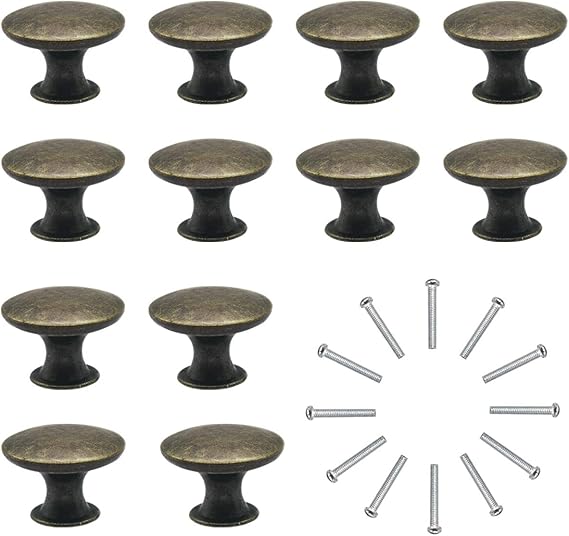
I want to click on two knobs in fourth row down, so click(218, 466), click(81, 465).